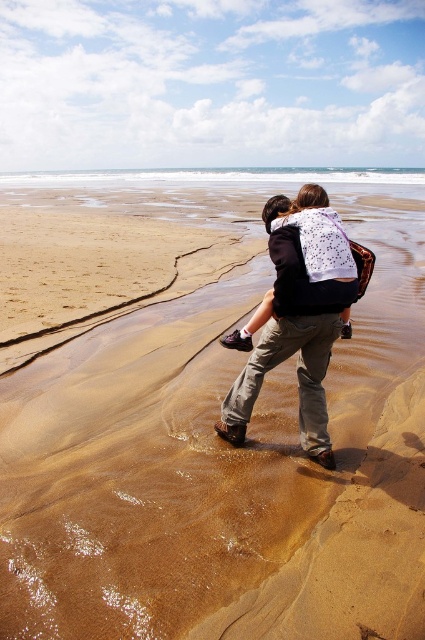
Question: Can you confirm if brown sand at center is positioned to the left of clear water at center?

Choices:
 (A) no
 (B) yes

Answer: (A)

Question: Which object is closer to the camera taking this photo?

Choices:
 (A) brown sand at center
 (B) clear water at center

Answer: (A)

Question: Is matte black hoodie at center bigger than clear water at center?

Choices:
 (A) yes
 (B) no

Answer: (B)

Question: Which object appears farthest from the camera in this image?

Choices:
 (A) brown sand at center
 (B) matte black hoodie at center

Answer: (B)

Question: Is matte black hoodie at center to the left of clear water at center from the viewer's perspective?

Choices:
 (A) no
 (B) yes

Answer: (A)

Question: Based on their relative distances, which object is farther from the matte black hoodie at center?

Choices:
 (A) brown sand at center
 (B) clear water at center

Answer: (B)